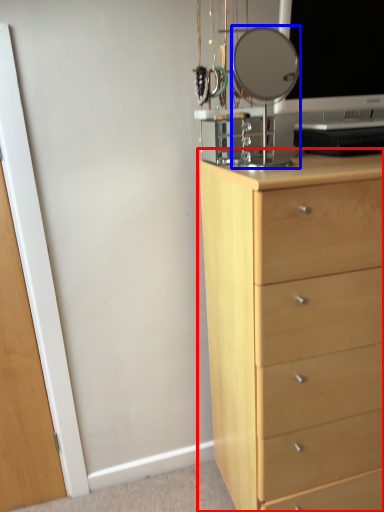
Question: Which object is further to the camera taking this photo, chest of drawers (highlighted by a red box) or mirror (highlighted by a blue box)?

Choices:
 (A) chest of drawers
 (B) mirror

Answer: (B)